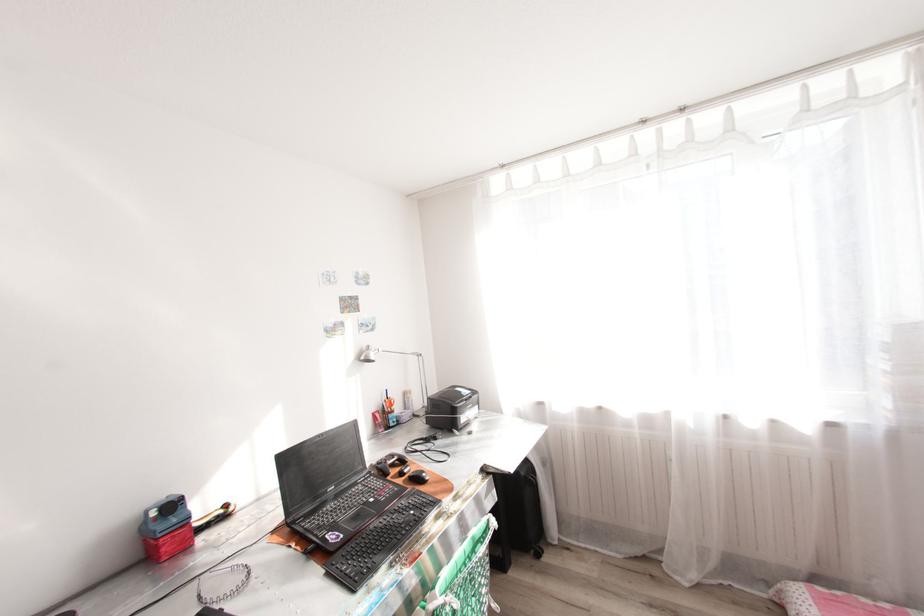
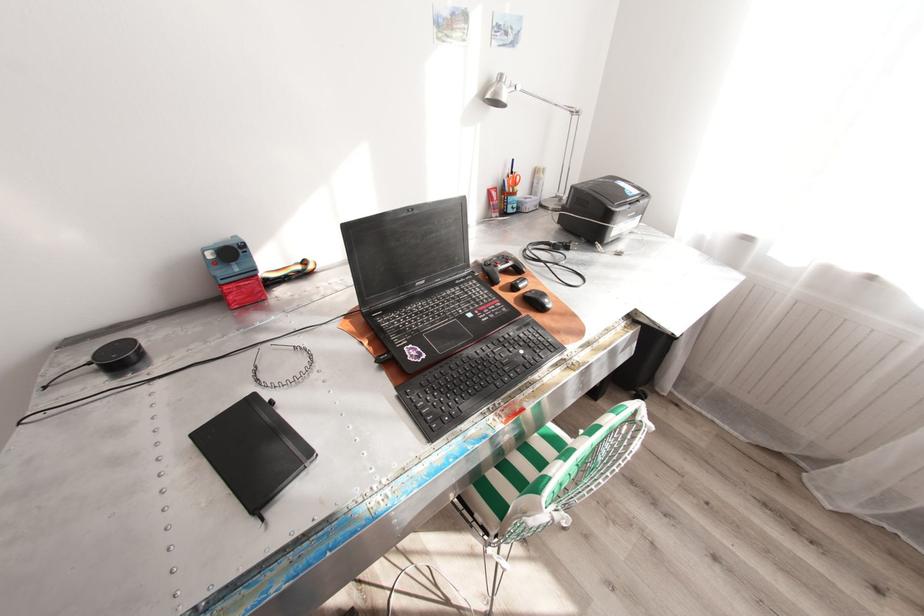
Find the pixel in the second image that matches (372,346) in the first image.

(505, 76)